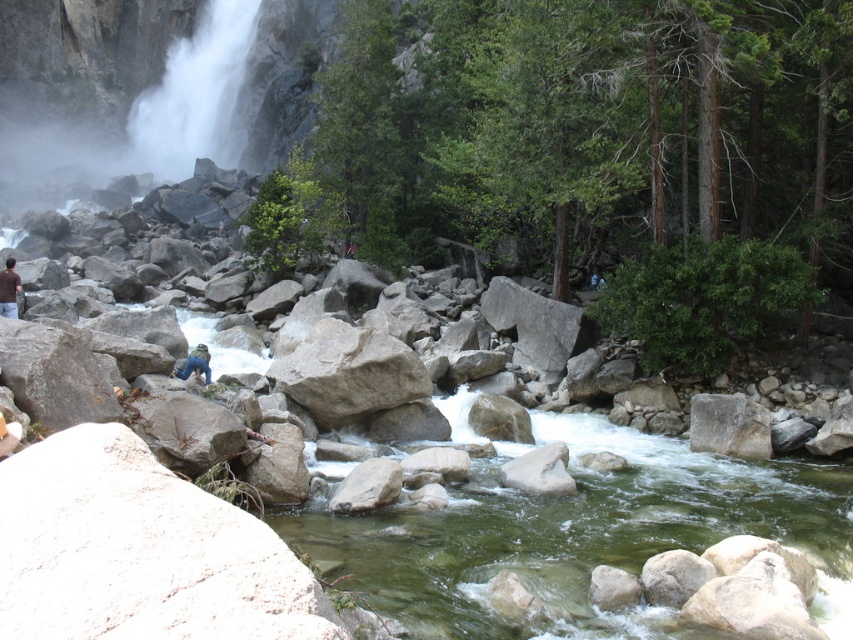
Question: Does clear stone stream at center come behind blue fabric pants at center?

Choices:
 (A) yes
 (B) no

Answer: (B)

Question: Does brown fabric shirt at lower left appear on the left side of blue fabric pants at center?

Choices:
 (A) no
 (B) yes

Answer: (B)

Question: Which object is closer to the camera taking this photo?

Choices:
 (A) clear stone stream at center
 (B) brown fabric shirt at lower left
 (C) blue fabric pants at center

Answer: (A)

Question: Does clear stone stream at center appear under blue fabric pants at center?

Choices:
 (A) yes
 (B) no

Answer: (A)

Question: Which object is farther from the camera taking this photo?

Choices:
 (A) brown fabric shirt at lower left
 (B) blue fabric pants at center

Answer: (A)

Question: Among these objects, which one is farthest from the camera?

Choices:
 (A) brown fabric shirt at lower left
 (B) blue fabric pants at center
 (C) clear stone stream at center

Answer: (A)